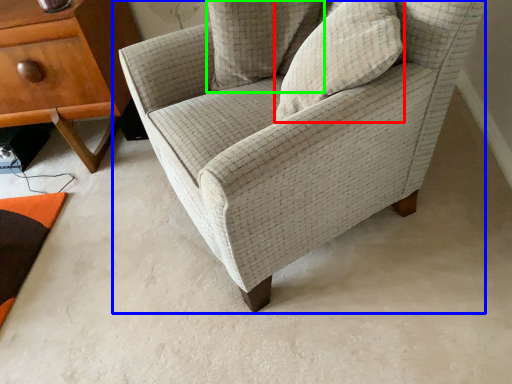
Question: Based on their relative distances, which object is nearer to pillow (highlighted by a red box)? Choose from chair (highlighted by a blue box) and pillow (highlighted by a green box).

Choices:
 (A) chair
 (B) pillow

Answer: (A)